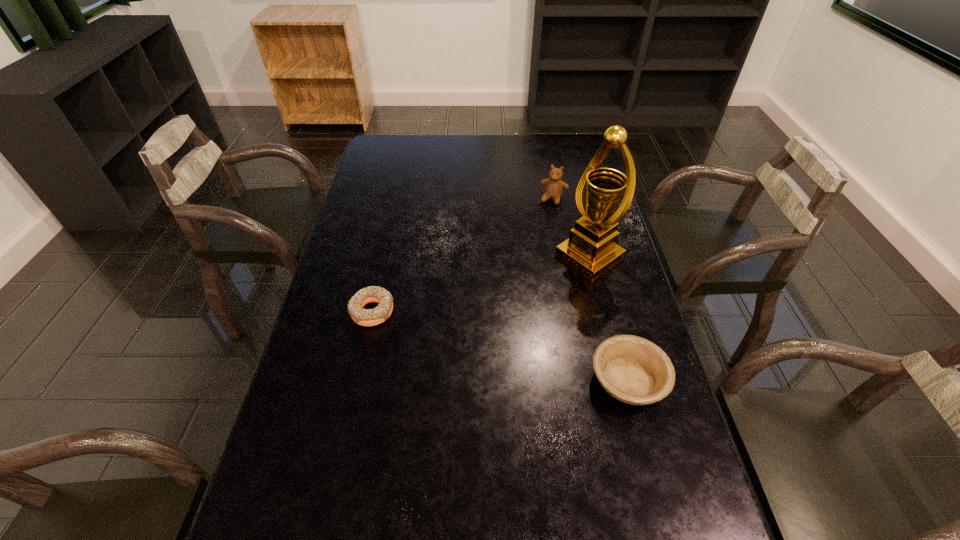
Locate an element on the screen. The height and width of the screenshot is (540, 960). free space at the far edge is located at coordinates (419, 150).

The width and height of the screenshot is (960, 540). Identify the location of vacant space at the near edge of the desktop. (351, 535).

The width and height of the screenshot is (960, 540). In order to click on vacant area at the left edge in this screenshot , I will do `click(300, 378)`.

Find the location of a particular element. vacant space at the right edge is located at coordinates (576, 189).

The width and height of the screenshot is (960, 540). Identify the location of vacant area at the far right corner. (574, 137).

The image size is (960, 540). In order to click on blank space at the near right corner of the desktop in this screenshot , I will do pyautogui.click(x=679, y=519).

The height and width of the screenshot is (540, 960). In order to click on free space that is in between the bowl and the tallest object in this screenshot , I will do pyautogui.click(x=609, y=319).

I want to click on unoccupied area between the doughnut and the third shortest object, so click(463, 255).

Find the location of a particular element. free space between the nearest object and the teddy bear is located at coordinates (590, 289).

You are a GUI agent. You are given a task and a screenshot of the screen. Output one action in this format:
    pyautogui.click(x=<x>, y=<y>)
    Task: Click on the blank region between the tallest object and the leftmost object
    
    Given the screenshot: What is the action you would take?
    pyautogui.click(x=481, y=284)